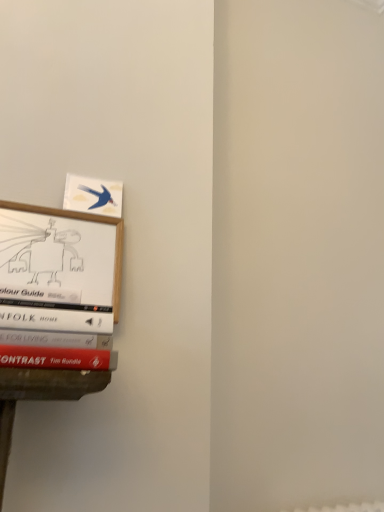
Question: Is wooden picture frame at left beside matte blue bird at upper left?

Choices:
 (A) yes
 (B) no

Answer: (A)

Question: Considering the relative sizes of wooden picture frame at left and matte blue bird at upper left in the image provided, is wooden picture frame at left smaller than matte blue bird at upper left?

Choices:
 (A) no
 (B) yes

Answer: (A)

Question: Would you say matte blue bird at upper left is part of wooden picture frame at left's contents?

Choices:
 (A) yes
 (B) no

Answer: (B)

Question: Would you say wooden picture frame at left is outside matte blue bird at upper left?

Choices:
 (A) no
 (B) yes

Answer: (B)

Question: From a real-world perspective, is wooden picture frame at left beneath matte blue bird at upper left?

Choices:
 (A) yes
 (B) no

Answer: (A)

Question: Is wooden picture frame at left facing away from matte blue bird at upper left?

Choices:
 (A) yes
 (B) no

Answer: (B)

Question: Is matte blue bird at upper left not inside wooden picture frame at left?

Choices:
 (A) no
 (B) yes

Answer: (B)

Question: Is matte blue bird at upper left taller than wooden picture frame at left?

Choices:
 (A) yes
 (B) no

Answer: (B)

Question: Is wooden picture frame at left located within matte blue bird at upper left?

Choices:
 (A) no
 (B) yes

Answer: (A)

Question: From the image's perspective, is matte blue bird at upper left on wooden picture frame at left?

Choices:
 (A) yes
 (B) no

Answer: (A)

Question: Is matte blue bird at upper left positioned before wooden picture frame at left?

Choices:
 (A) no
 (B) yes

Answer: (A)

Question: Does matte blue bird at upper left have a larger size compared to wooden picture frame at left?

Choices:
 (A) no
 (B) yes

Answer: (A)

Question: Is matte blue bird at upper left bigger or smaller than wooden picture frame at left?

Choices:
 (A) small
 (B) big

Answer: (A)